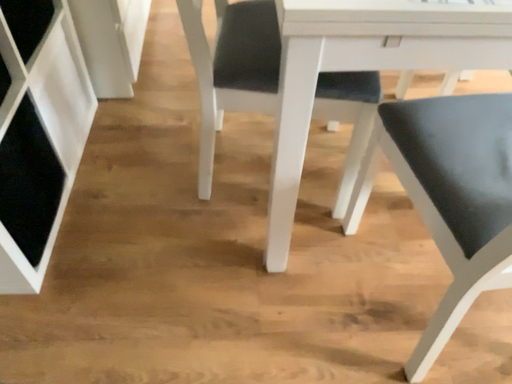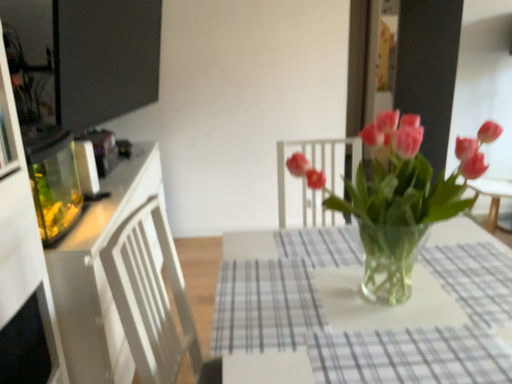
Question: How did the camera likely rotate when shooting the video?

Choices:
 (A) rotated upward
 (B) rotated downward

Answer: (A)